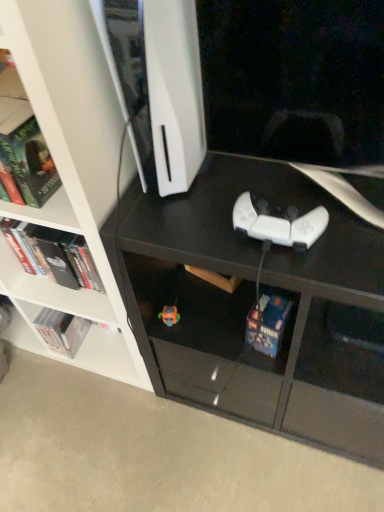
This screenshot has width=384, height=512. Identify the location of unoccupied space behind white matte game controller at center. (256, 180).